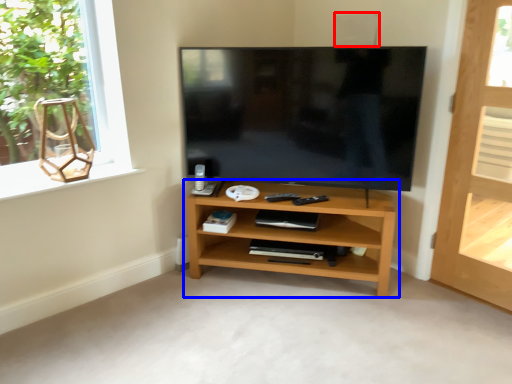
Question: Among these objects, which one is nearest to the camera, speaker (highlighted by a red box) or shelf (highlighted by a blue box)?

Choices:
 (A) speaker
 (B) shelf

Answer: (B)